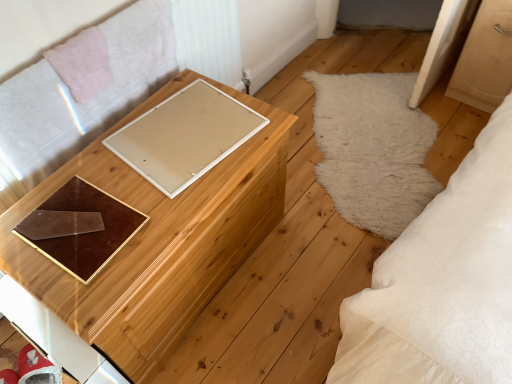
Question: Is beige matte board at center aimed at wooden chest at center?

Choices:
 (A) yes
 (B) no

Answer: (A)

Question: Is beige matte board at center in front of wooden chest at center?

Choices:
 (A) yes
 (B) no

Answer: (B)

Question: Is beige matte board at center not near wooden chest at center?

Choices:
 (A) yes
 (B) no

Answer: (B)

Question: From a real-world perspective, is beige matte board at center located higher than wooden chest at center?

Choices:
 (A) yes
 (B) no

Answer: (A)

Question: Is the position of beige matte board at center more distant than that of wooden chest at center?

Choices:
 (A) no
 (B) yes

Answer: (B)

Question: Is wooden chest at center wider or thinner than beige matte board at center?

Choices:
 (A) thin
 (B) wide

Answer: (B)

Question: Choose the correct answer: Is wooden chest at center inside beige matte board at center or outside it?

Choices:
 (A) outside
 (B) inside

Answer: (A)

Question: In terms of size, does wooden chest at center appear bigger or smaller than beige matte board at center?

Choices:
 (A) big
 (B) small

Answer: (A)

Question: From a real-world perspective, relative to beige matte board at center, is wooden chest at center vertically above or below?

Choices:
 (A) below
 (B) above

Answer: (A)

Question: From the image's perspective, is beige matte board at center above or below brown glossy tray at center?

Choices:
 (A) above
 (B) below

Answer: (A)

Question: Do you think beige matte board at center is within brown glossy tray at center, or outside of it?

Choices:
 (A) outside
 (B) inside

Answer: (A)

Question: From a real-world perspective, relative to brown glossy tray at center, is beige matte board at center vertically above or below?

Choices:
 (A) below
 (B) above

Answer: (A)

Question: In terms of size, does beige matte board at center appear bigger or smaller than brown glossy tray at center?

Choices:
 (A) big
 (B) small

Answer: (A)

Question: Is point (56, 221) closer or farther from the camera than point (197, 215)?

Choices:
 (A) farther
 (B) closer

Answer: (B)

Question: Is brown glossy tray at center taller or shorter than wooden chest at center?

Choices:
 (A) short
 (B) tall

Answer: (A)